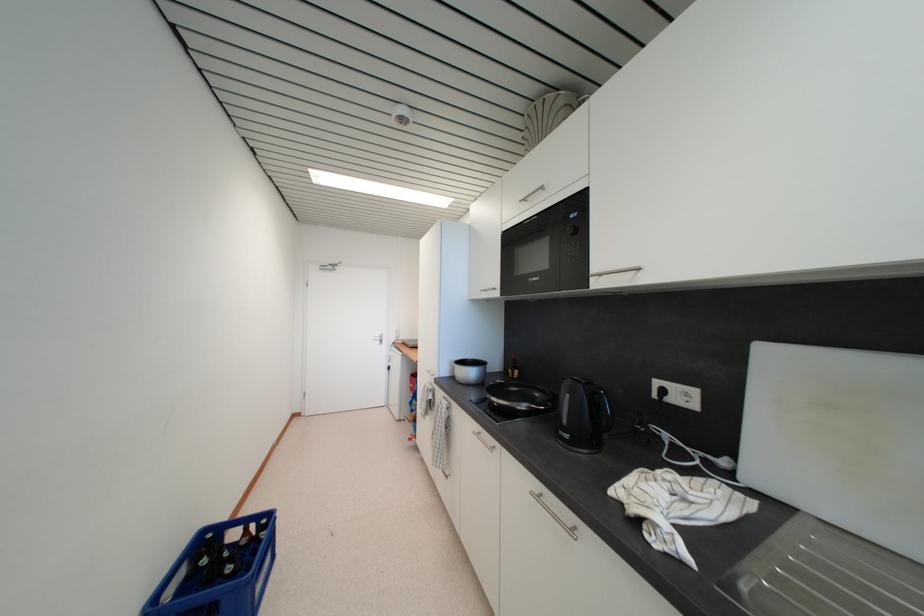
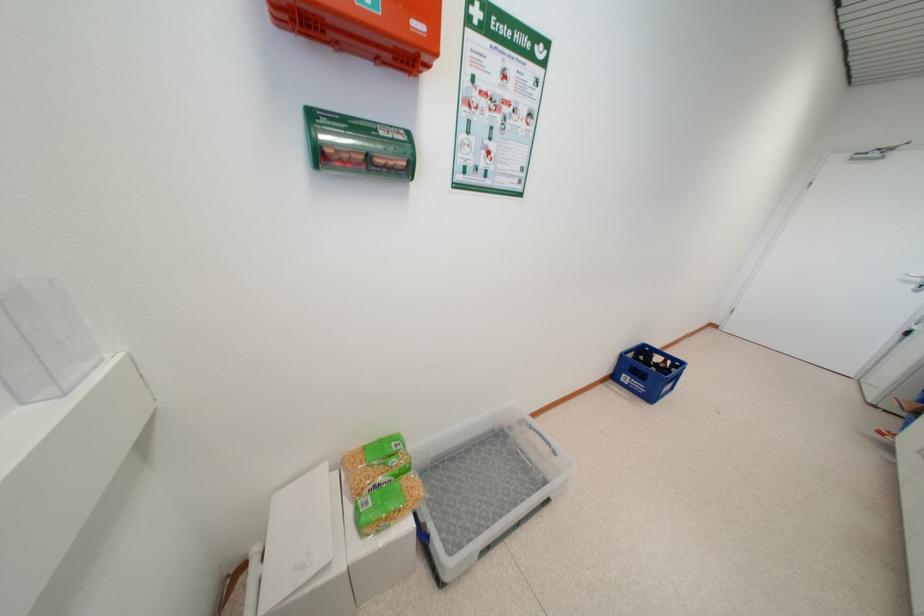
Find the pixel in the second image that matches (x=381, y=342) in the first image.

(912, 284)